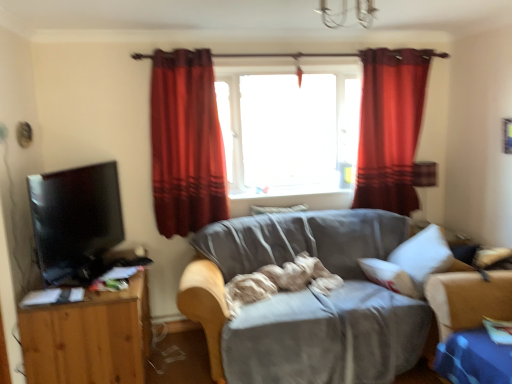
Question: Would you say red velvet curtain at upper center, placed as the 1th curtain when sorted from right to left, is inside or outside velvet red curtain at center, which is the 1th curtain from left to right?

Choices:
 (A) inside
 (B) outside

Answer: (B)

Question: From a real-world perspective, is red velvet curtain at upper center, placed as the 1th curtain when sorted from right to left, physically located above or below velvet red curtain at center, which appears as the 2th curtain when viewed from the right?

Choices:
 (A) above
 (B) below

Answer: (A)

Question: Which of these objects is positioned closest to the red velvet curtain at upper center, the 2th curtain viewed from the left?

Choices:
 (A) wooden tv stand at left
 (B) velvet red curtain at center, which is the 1th curtain from left to right
 (C) matte black tv at left
 (D) gray fabric couch at center
 (E) transparent glass window at center

Answer: (E)

Question: Which is nearer to the wooden tv stand at left?

Choices:
 (A) transparent glass window at center
 (B) red velvet curtain at upper center, the 2th curtain viewed from the left
 (C) gray fabric couch at center
 (D) matte black tv at left
 (E) velvet red curtain at center, which appears as the 2th curtain when viewed from the right

Answer: (D)